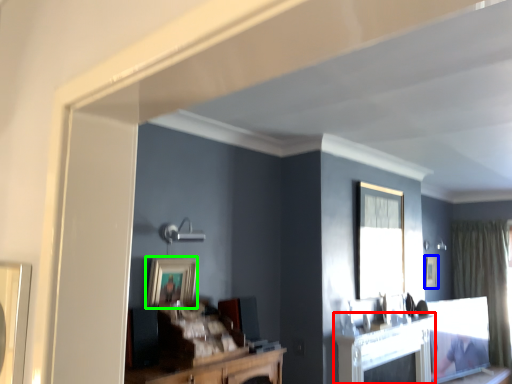
Question: Which object is positioned closest to fireplace (highlighted by a red box)? Select from picture frame (highlighted by a blue box) and picture frame (highlighted by a green box).

Choices:
 (A) picture frame
 (B) picture frame

Answer: (B)